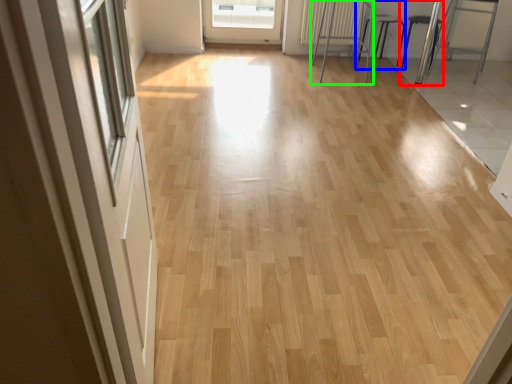
Question: Which is farther away from armchair (highlighted by a red box)? armchair (highlighted by a blue box) or furniture (highlighted by a green box)?

Choices:
 (A) armchair
 (B) furniture

Answer: (B)